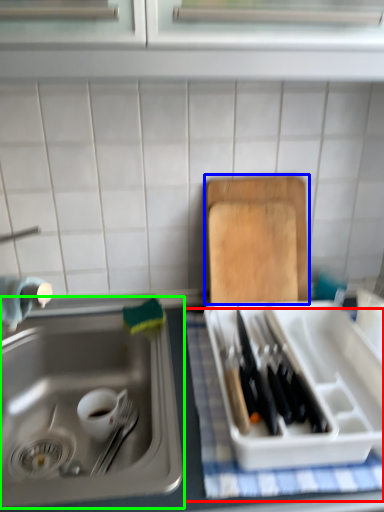
Question: Which object is positioned farthest from tablecloth (highlighted by a red box)? Select from cutting board (highlighted by a blue box) and sink (highlighted by a green box).

Choices:
 (A) cutting board
 (B) sink

Answer: (A)